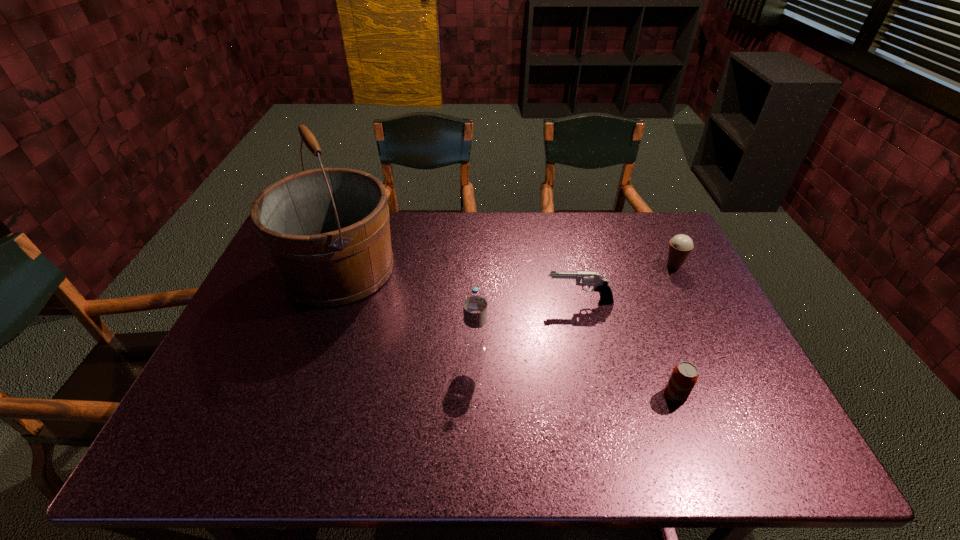
Find the location of `vacant space located 0.360m on the left of the icecream`. vacant space located 0.360m on the left of the icecream is located at coordinates (548, 266).

The image size is (960, 540). I want to click on free region located at the muzzle of the gun, so click(x=518, y=301).

This screenshot has height=540, width=960. What are the coordinates of `free spot located at the muzzle of the gun` in the screenshot? It's located at (424, 301).

This screenshot has height=540, width=960. I want to click on vacant area located 0.110m at the muzzle of the gun, so click(x=508, y=301).

What are the coordinates of `vacant region located 0.100m on the left of the fourth object from left to right` in the screenshot? It's located at (622, 395).

You are a GUI agent. You are given a task and a screenshot of the screen. Output one action in this format:
    pyautogui.click(x=<x>, y=<y>)
    Task: Click on the object present at the far edge
    
    Given the screenshot: What is the action you would take?
    tap(326, 231)

I want to click on object at the left edge, so click(326, 231).

Identify the location of object situated at the right edge. The width and height of the screenshot is (960, 540). (680, 246).

Identify the location of object located at the far left corner. The width and height of the screenshot is (960, 540). click(326, 231).

Locate an element on the screen. The image size is (960, 540). free space at the far edge is located at coordinates (601, 233).